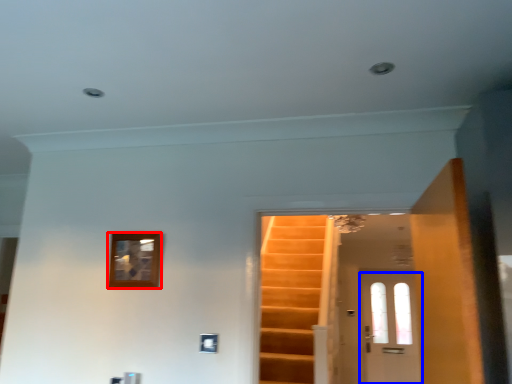
Question: Which of the following is the closest to the observer, picture frame (highlighted by a red box) or door (highlighted by a blue box)?

Choices:
 (A) picture frame
 (B) door

Answer: (A)